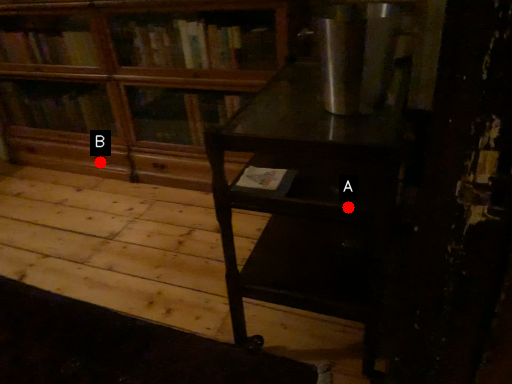
Question: Two points are circled on the image, labeled by A and B beside each circle. Which point is closer to the camera?

Choices:
 (A) A is closer
 (B) B is closer

Answer: (A)